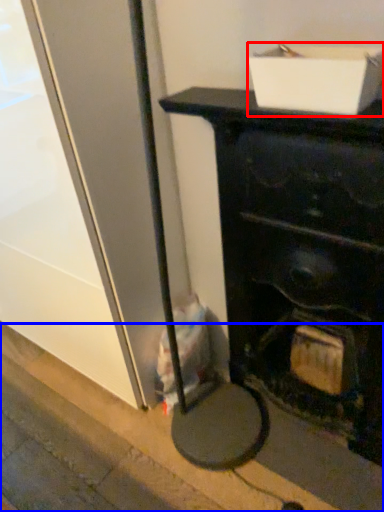
Question: Which object is further to the camera taking this photo, cardboard box (highlighted by a red box) or pavement (highlighted by a blue box)?

Choices:
 (A) cardboard box
 (B) pavement

Answer: (B)